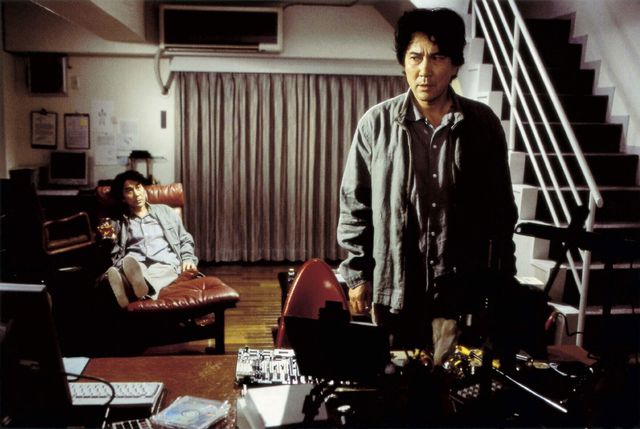
You are a GUI agent. You are given a task and a screenshot of the screen. Output one action in this format:
    pyautogui.click(x=<x>, y=<y>)
    Task: Click on the table
    The height and width of the screenshot is (429, 640).
    Given the screenshot: What is the action you would take?
    click(x=171, y=383)